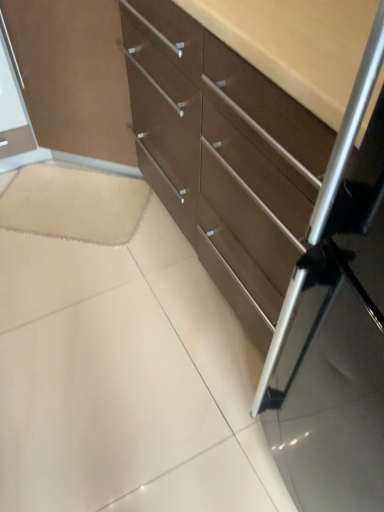
The height and width of the screenshot is (512, 384). Find the location of `free space in front of beige soft carpet at lower left`. free space in front of beige soft carpet at lower left is located at coordinates (72, 289).